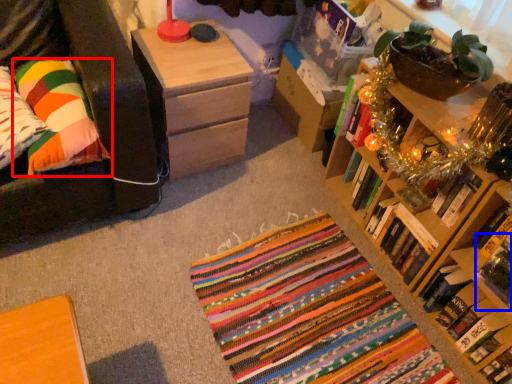
Question: Which object appears farthest to the camera in this image, pillow (highlighted by a red box) or book (highlighted by a blue box)?

Choices:
 (A) pillow
 (B) book

Answer: (A)